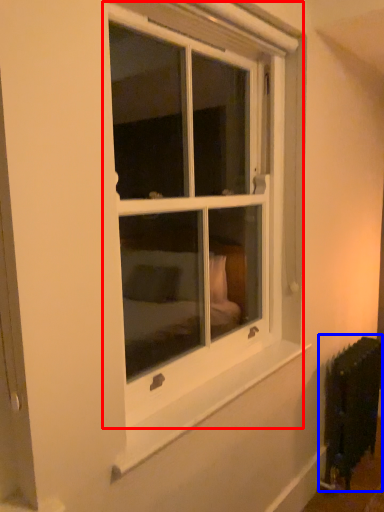
Question: Which point is closer to the camera, window (highlighted by a red box) or radiator (highlighted by a blue box)?

Choices:
 (A) window
 (B) radiator

Answer: (A)